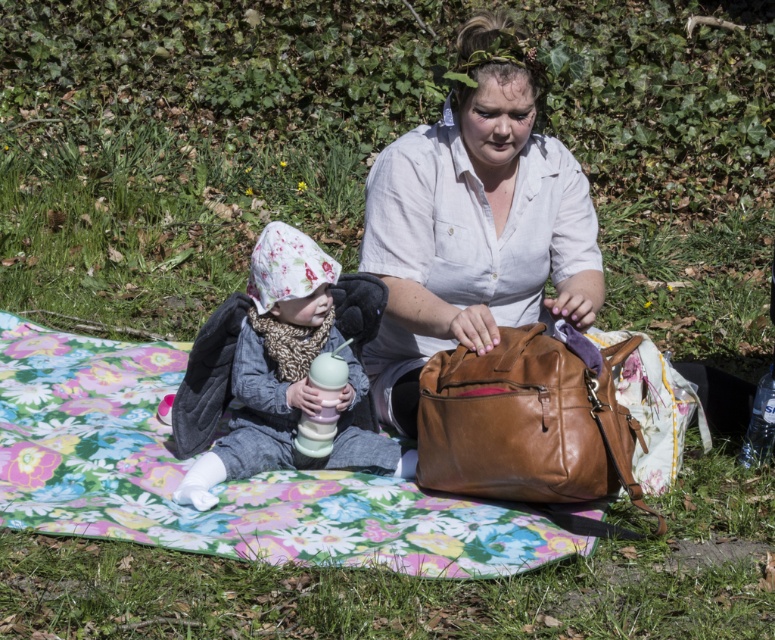
You are standing in the park and see a picnic scene with a child and an adult. There is a point marked at coordinate (474,224). What object is located at this point?

The point at coordinate (474,224) indicates the matte white shirt at center.

You are a delivery robot with a 3.5 feet wide package. You need to move from the left side of the image to the right side. There is a fluffy fleece hat at center and a clear plastic bottle at lower right in your path. Can you pass between them without moving the objects?

The distance between the fluffy fleece hat at center and the clear plastic bottle at lower right is 5.08 feet. Since your package is 3.5 feet wide, there is enough space to pass between them without moving the objects.

You are planning to set up a small tent on the picnic blanket. Considering the space occupied by the floral fabric blanket at center and the matte white shirt at center, will there be enough room for the tent?

The floral fabric blanket at center is not as tall as the matte white shirt at center, but the description does not provide specific measurements about the size of the blanket or the shirt. Therefore, it is unclear if there will be enough room for the tent based on the given information.